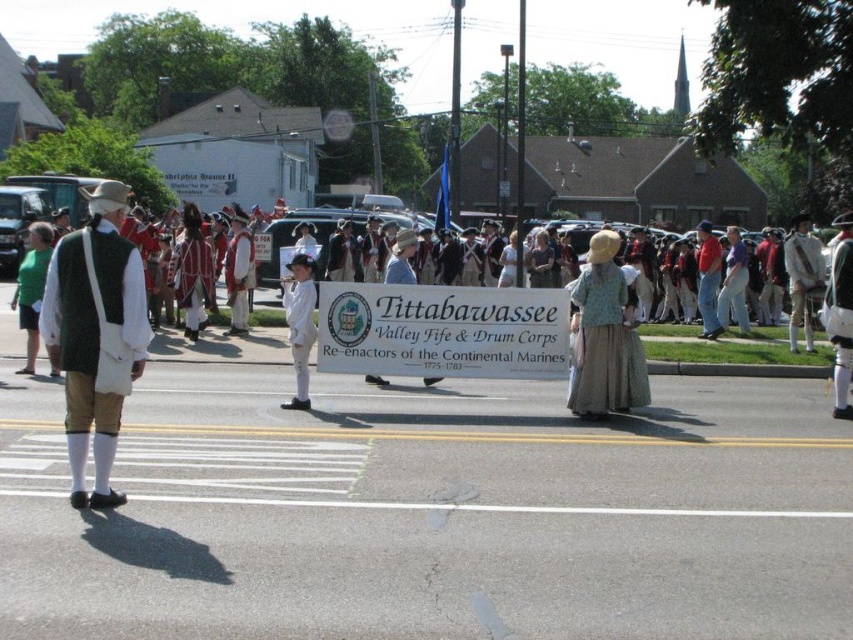
Can you confirm if light blue fabric dress at center is positioned below white cotton shirt at center?

No, light blue fabric dress at center is not below white cotton shirt at center.

Is point (630, 301) behind point (309, 340)?

No, it is not.

Where is `light blue fabric dress at center`? The image size is (853, 640). light blue fabric dress at center is located at coordinates (606, 337).

You are a GUI agent. You are given a task and a screenshot of the screen. Output one action in this format:
    pyautogui.click(x=<x>, y=<y>)
    Task: Click on the light blue fabric dress at center
    
    Given the screenshot: What is the action you would take?
    pyautogui.click(x=606, y=337)

Measure the distance from light blue fabric dress at center to white linen shirt at center.

A distance of 6.30 meters exists between light blue fabric dress at center and white linen shirt at center.

Where is `light blue fabric dress at center`? This screenshot has height=640, width=853. light blue fabric dress at center is located at coordinates (606, 337).

Locate an element on the screen. This screenshot has width=853, height=640. light blue fabric dress at center is located at coordinates (606, 337).

Where is `light blue fabric dress at center`? The height and width of the screenshot is (640, 853). light blue fabric dress at center is located at coordinates (606, 337).

Who is positioned more to the left, green wool vest at left or white cotton shirt at center?

Positioned to the left is green wool vest at left.

Is green wool vest at left to the right of white cotton shirt at center from the viewer's perspective?

In fact, green wool vest at left is to the left of white cotton shirt at center.

Between point (111, 364) and point (294, 369), which one is positioned behind?

Point (294, 369)

At what (x,y) coordinates should I click in order to perform the action: click on green wool vest at left. Please return your answer as a coordinate pair (x, y). Image resolution: width=853 pixels, height=640 pixels. Looking at the image, I should click on (96, 333).